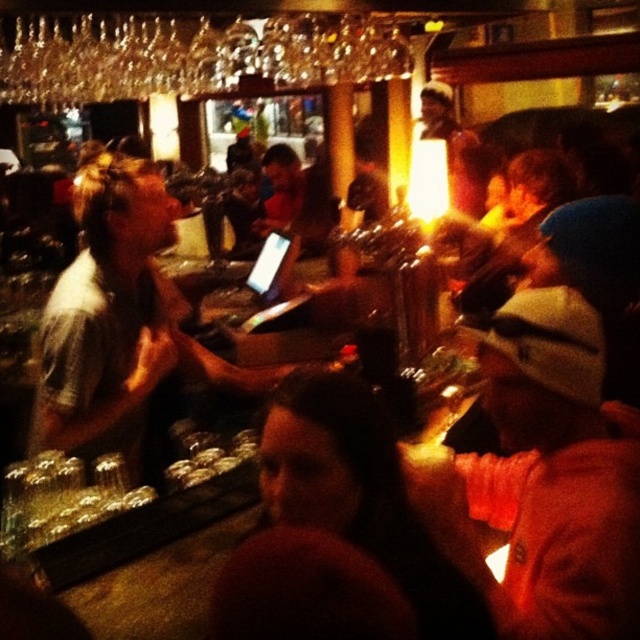
You are a bartender who needs to move a glass from the orange knit cap at lower right to the gray casual shirt at center. Can you do this without moving any other items on the bar counter?

The distance between the orange knit cap at lower right and the gray casual shirt at center is 3.57 feet, so yes, the bartender can move the glass between them without disturbing other items if there is a clear path.

You are a bartender at the bar counter. You need to place a new menu board between the orange knit cap at lower right and the gray casual shirt at center. Considering their sizes, which object should the menu board be closer to?

The menu board should be closer to the orange knit cap at lower right because it has a smaller size compared to the gray casual shirt at center, so placing it nearer to the smaller object would balance the spacing between them.